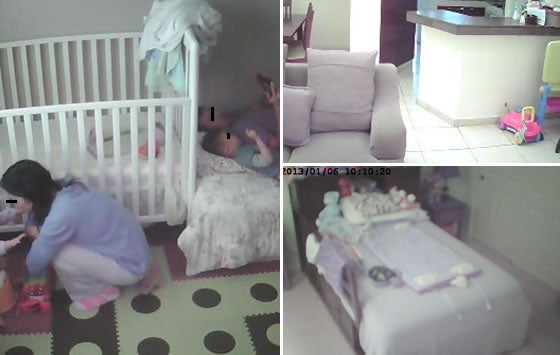
I want to click on wall, so click(x=527, y=244).